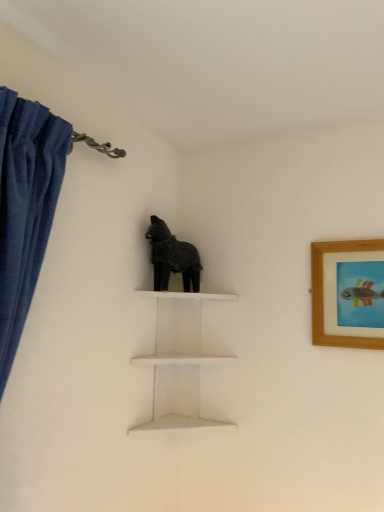
Question: From a real-world perspective, is white matte shelf at center physically located above or below wooden framed picture at upper right?

Choices:
 (A) below
 (B) above

Answer: (A)

Question: From the image's perspective, is white matte shelf at center above or below wooden framed picture at upper right?

Choices:
 (A) above
 (B) below

Answer: (B)

Question: Which is nearer to the fuzzy black dog at center?

Choices:
 (A) white matte shelf at center
 (B) wooden framed picture at upper right

Answer: (A)

Question: Which object is positioned closest to the white matte shelf at center?

Choices:
 (A) fuzzy black dog at center
 (B) wooden framed picture at upper right

Answer: (A)